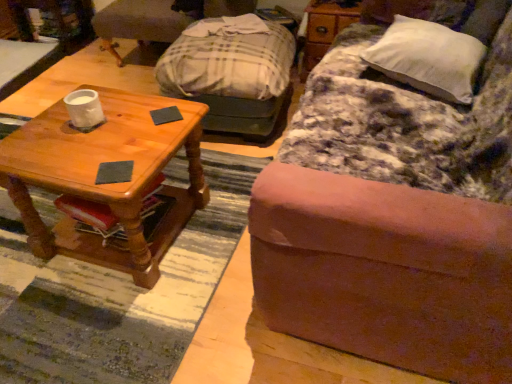
Question: Are wooden coffee table at left and wooden dresser at upper right making contact?

Choices:
 (A) no
 (B) yes

Answer: (A)

Question: Considering the relative sizes of wooden coffee table at left and wooden dresser at upper right in the image provided, is wooden coffee table at left wider than wooden dresser at upper right?

Choices:
 (A) yes
 (B) no

Answer: (A)

Question: Is wooden coffee table at left not near wooden dresser at upper right?

Choices:
 (A) no
 (B) yes

Answer: (B)

Question: Does wooden coffee table at left appear on the right side of wooden dresser at upper right?

Choices:
 (A) no
 (B) yes

Answer: (A)

Question: Considering the relative positions of wooden coffee table at left and wooden dresser at upper right in the image provided, is wooden coffee table at left in front of wooden dresser at upper right?

Choices:
 (A) no
 (B) yes

Answer: (B)

Question: Relative to white soft pillow at upper right, is plaid fabric swivel chair at center, the 2th swivel chair in the front-to-back sequence, in front or behind?

Choices:
 (A) front
 (B) behind

Answer: (B)

Question: Is point pos(129,36) positioned closer to the camera than point pos(389,26)?

Choices:
 (A) farther
 (B) closer

Answer: (A)

Question: In terms of height, does plaid fabric swivel chair at center, the 2th swivel chair in the front-to-back sequence, look taller or shorter compared to white soft pillow at upper right?

Choices:
 (A) tall
 (B) short

Answer: (A)

Question: Is plaid fabric swivel chair at center, the 2th swivel chair in the front-to-back sequence, inside the boundaries of white soft pillow at upper right, or outside?

Choices:
 (A) outside
 (B) inside

Answer: (A)

Question: From the image's perspective, is brushed metal desk at upper left above or below gray felt coaster at center, marked as the first pad in a front-to-back arrangement?

Choices:
 (A) below
 (B) above

Answer: (B)

Question: Is brushed metal desk at upper left in front of or behind gray felt coaster at center, which is the 2th pad from top to bottom, in the image?

Choices:
 (A) front
 (B) behind

Answer: (B)

Question: Considering the positions of brushed metal desk at upper left and gray felt coaster at center, arranged as the second pad when viewed from the back, in the image, is brushed metal desk at upper left bigger or smaller than gray felt coaster at center, arranged as the second pad when viewed from the back,?

Choices:
 (A) small
 (B) big

Answer: (B)

Question: From a real-world perspective, is brushed metal desk at upper left above or below gray felt coaster at center, which is the 2th pad from top to bottom?

Choices:
 (A) above
 (B) below

Answer: (B)

Question: From the image's perspective, is dark gray matte coaster at center, acting as the 1th pad starting from the top, located above or below wooden dresser at upper right?

Choices:
 (A) above
 (B) below

Answer: (B)

Question: Is dark gray matte coaster at center, the 2th pad in the front-to-back sequence, inside the boundaries of wooden dresser at upper right, or outside?

Choices:
 (A) inside
 (B) outside

Answer: (B)